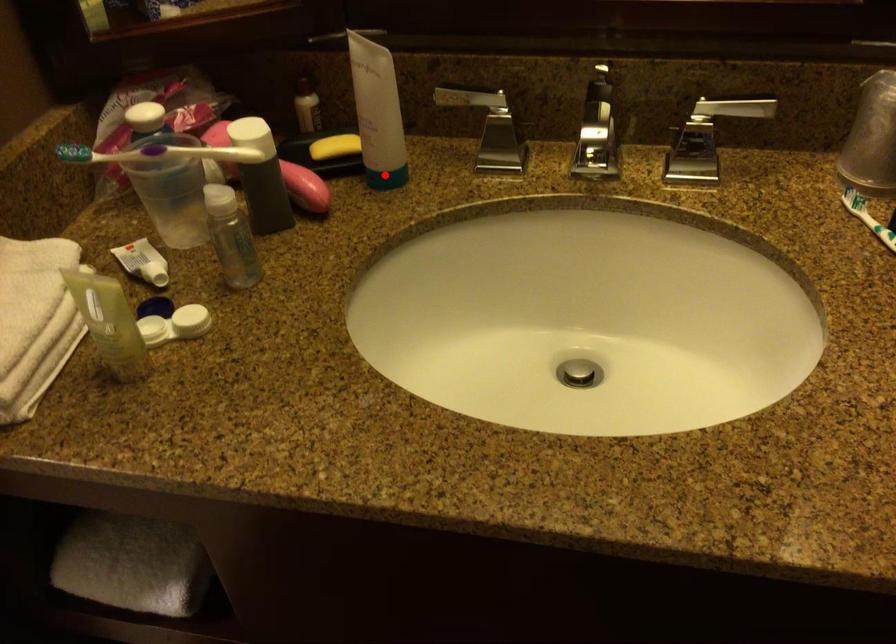
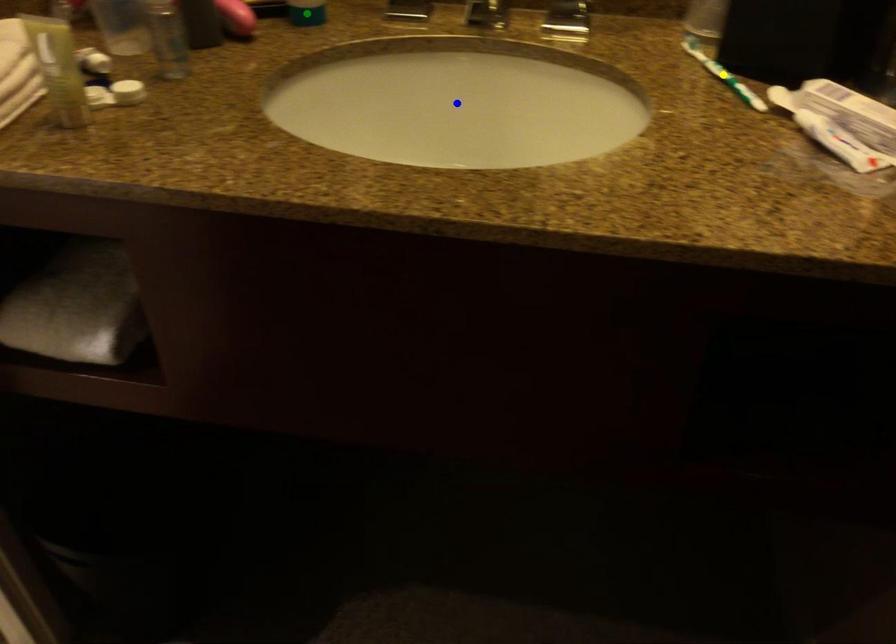
Question: I am providing you with two images of the same scene from different viewpoints. A red point is marked on the first image. You are given multiple points on the second image. In image 2, which mark is for the same physical point as the one in image 1?

Choices:
 (A) green point
 (B) blue point
 (C) yellow point

Answer: (A)